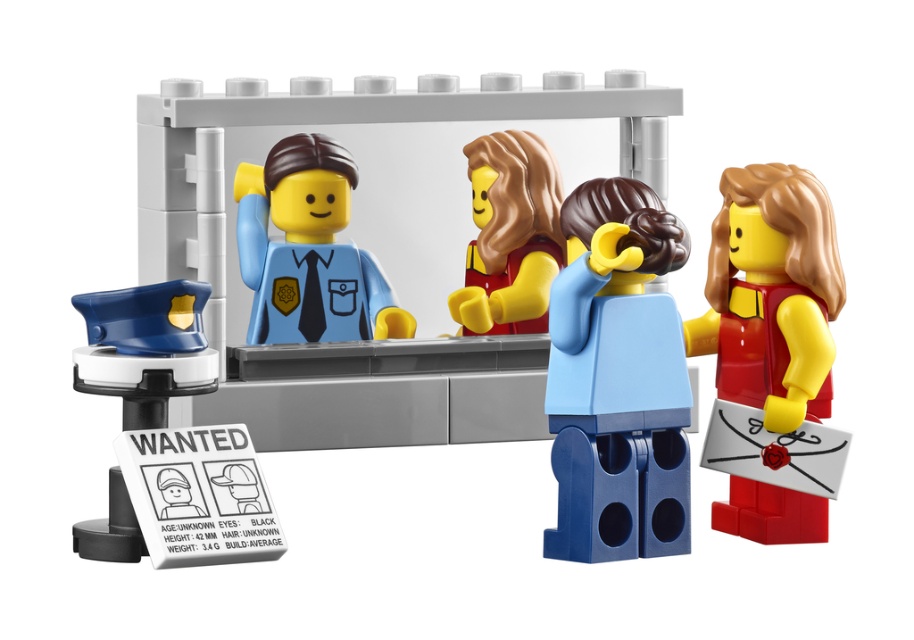
Who is shorter, blue plastic police hat at left or smooth brown hair at center?

With less height is smooth brown hair at center.

Is blue plastic police hat at left further to camera compared to smooth brown hair at center?

That is False.

Describe the element at coordinates (145, 348) in the screenshot. I see `blue plastic police hat at left` at that location.

The height and width of the screenshot is (640, 914). I want to click on blue plastic police hat at left, so click(x=145, y=348).

Is smooth red dress at right positioned behind blue plastic police hat at left?

Yes, smooth red dress at right is behind blue plastic police hat at left.

Is smooth red dress at right smaller than blue plastic police hat at left?

No, smooth red dress at right is not smaller than blue plastic police hat at left.

In the scene shown: Who is more distant from viewer, (794, 196) or (192, 378)?

The point (794, 196) is more distant.

At what (x,y) coordinates should I click in order to perform the action: click on smooth red dress at right. Please return your answer as a coordinate pair (x, y). This screenshot has width=914, height=640. Looking at the image, I should click on (771, 294).

Who is higher up, smooth red dress at right or smooth brown hair at center?

smooth brown hair at center is higher up.

Is smooth red dress at right taller than smooth brown hair at center?

Yes.

Describe the element at coordinates (771, 294) in the screenshot. This screenshot has height=640, width=914. I see `smooth red dress at right` at that location.

Find the location of a particular element. The image size is (914, 640). smooth red dress at right is located at coordinates (771, 294).